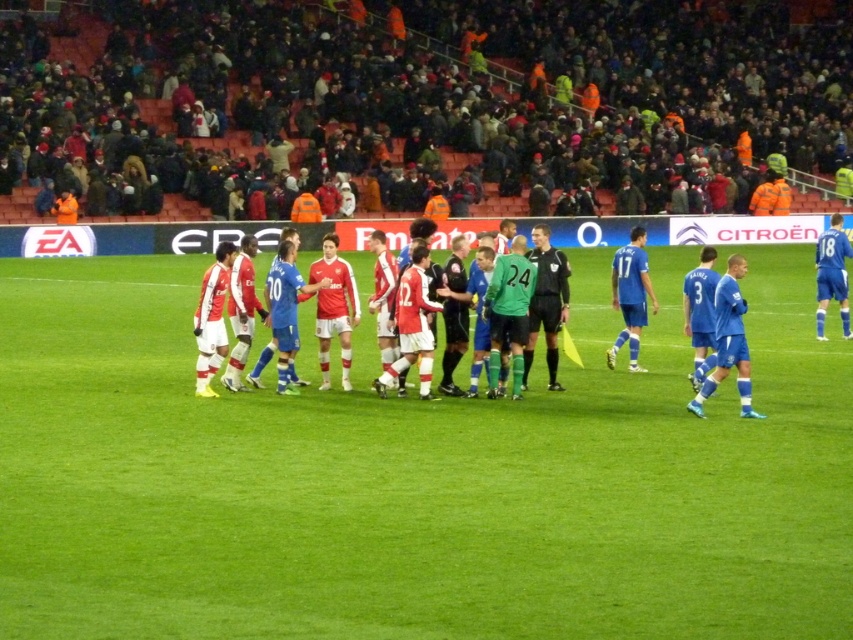
Can you confirm if green grass field at center is thinner than blue smooth jersey at right?

In fact, green grass field at center might be wider than blue smooth jersey at right.

Who is lower down, green grass field at center or blue smooth jersey at right?

green grass field at center

What are the coordinates of `green grass field at center` in the screenshot? It's located at (415, 480).

The image size is (853, 640). I want to click on green grass field at center, so click(415, 480).

Which of these two, matte red jersey at center or blue smooth jersey at right, stands shorter?

blue smooth jersey at right

Consider the image. Who is more distant from viewer, [294,246] or [639,259]?

The point [639,259] is behind.

Who is more forward, (343, 384) or (618, 346)?

Positioned in front is point (343, 384).

The width and height of the screenshot is (853, 640). What are the coordinates of `matte red jersey at center` in the screenshot? It's located at (421, 228).

Which of these two, black jersey at center or blue smooth jersey at right, stands taller?

black jersey at center

Which is behind, point (540, 284) or point (607, 355)?

Point (607, 355)

Locate an element on the screen. This screenshot has width=853, height=640. black jersey at center is located at coordinates tap(546, 301).